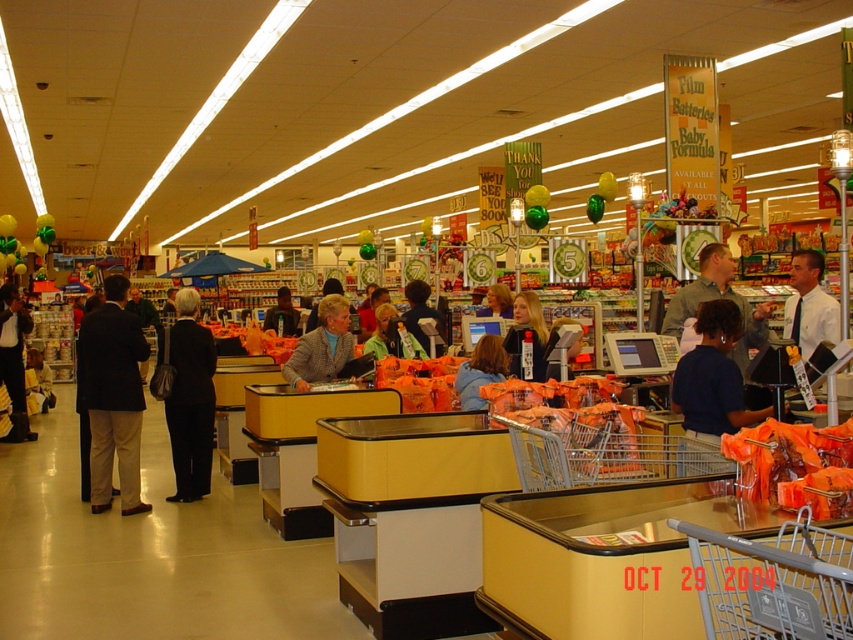
Question: Can you confirm if black fabric coat at center is positioned above light brown tweed jacket at center?

Choices:
 (A) yes
 (B) no

Answer: (B)

Question: Estimate the real-world distances between objects in this image. Which object is farther from the black leather jacket at left?

Choices:
 (A) gray shirt at checkout
 (B) dark brown leather jacket at center

Answer: (A)

Question: Based on their relative distances, which object is farther from the gray plastic shopping cart at lower right?

Choices:
 (A) black fabric coat at center
 (B) gray shirt at checkout
 (C) blue fabric jacket at center
 (D) black leather jacket at left

Answer: (D)

Question: Can you confirm if light brown tweed jacket at center is bigger than blue fabric jacket at center?

Choices:
 (A) yes
 (B) no

Answer: (A)

Question: Which point is farther from the camera taking this photo?

Choices:
 (A) (338, 312)
 (B) (192, 442)
 (C) (109, 296)
 (D) (12, 420)

Answer: (D)

Question: Can you confirm if black leather jacket at left is wider than dark brown leather jacket at center?

Choices:
 (A) yes
 (B) no

Answer: (B)